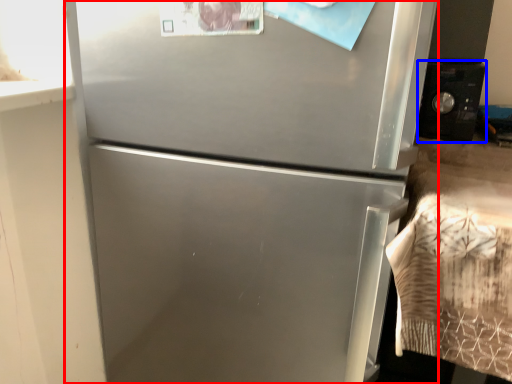
Question: Which of the following is the closest to the observer, refrigerator (highlighted by a red box) or appliance (highlighted by a blue box)?

Choices:
 (A) refrigerator
 (B) appliance

Answer: (A)